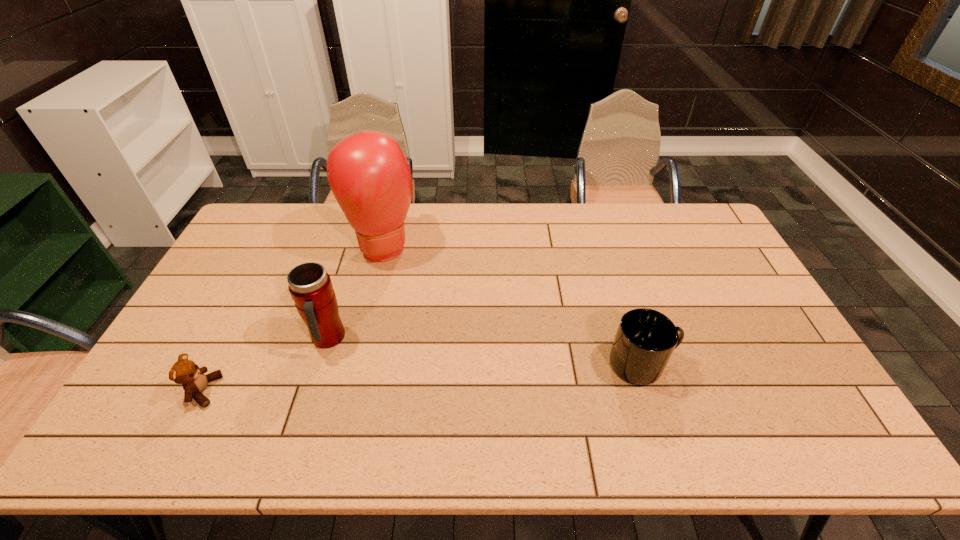
Where is `blank space at the far edge of the desktop`? The width and height of the screenshot is (960, 540). blank space at the far edge of the desktop is located at coordinates (412, 226).

In order to click on vacant space at the near edge in this screenshot , I will do `click(431, 399)`.

This screenshot has height=540, width=960. I want to click on vacant space at the left edge, so click(237, 261).

Locate an element on the screen. vacant space at the right edge is located at coordinates (779, 330).

Where is `free location at the far right corner`? The image size is (960, 540). free location at the far right corner is located at coordinates point(693,231).

Where is `unoccupied area between the leftmost object and the farthest object`? unoccupied area between the leftmost object and the farthest object is located at coordinates (294, 318).

At what (x,y) coordinates should I click in order to perform the action: click on free spot between the leftmost object and the farthest object. Please return your answer as a coordinate pair (x, y). Looking at the image, I should click on (294, 318).

Identify the location of free space between the farthest object and the mug. This screenshot has width=960, height=540. (514, 305).

Find the location of a particular element. vacant area between the tallest object and the third tallest object is located at coordinates (514, 305).

At what (x,y) coordinates should I click in order to perform the action: click on vacant area that lies between the mug and the leftmost object. Please return your answer as a coordinate pair (x, y). Looking at the image, I should click on (423, 377).